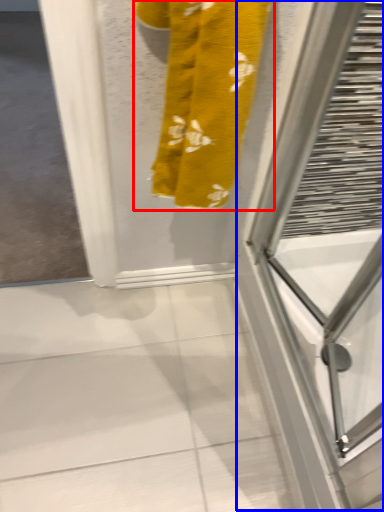
Question: Which object is closer to the camera taking this photo, towel (highlighted by a red box) or screen door (highlighted by a blue box)?

Choices:
 (A) towel
 (B) screen door

Answer: (A)